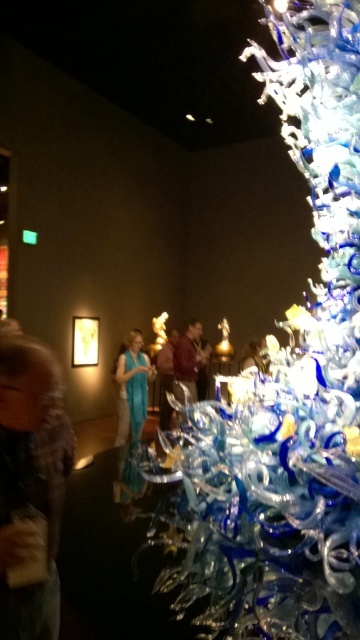
Question: Can you confirm if blue glass sculpture at right is bigger than teal fabric dress at center?

Choices:
 (A) yes
 (B) no

Answer: (A)

Question: Among these points, which one is farthest from the camera?

Choices:
 (A) (162, 349)
 (B) (205, 353)
 (C) (191, 582)
 (D) (20, 445)

Answer: (B)

Question: Which point is farther to the camera?

Choices:
 (A) teal silk dress at center
 (B) teal fabric dress at center
 (C) maroon fabric jacket at center

Answer: (B)

Question: Does maroon fabric jacket at center have a larger size compared to teal fabric dress at center?

Choices:
 (A) yes
 (B) no

Answer: (A)

Question: Is teal silk dress at center to the right of maroon fabric jacket at center from the viewer's perspective?

Choices:
 (A) yes
 (B) no

Answer: (B)

Question: Which of the following is the farthest from the observer?

Choices:
 (A) maroon fabric jacket at center
 (B) teal silk dress at center

Answer: (A)